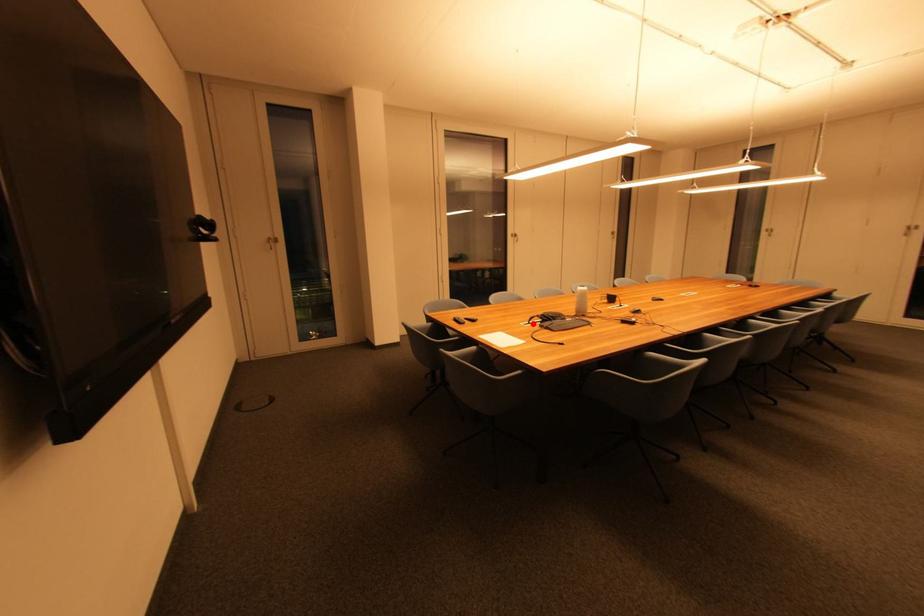
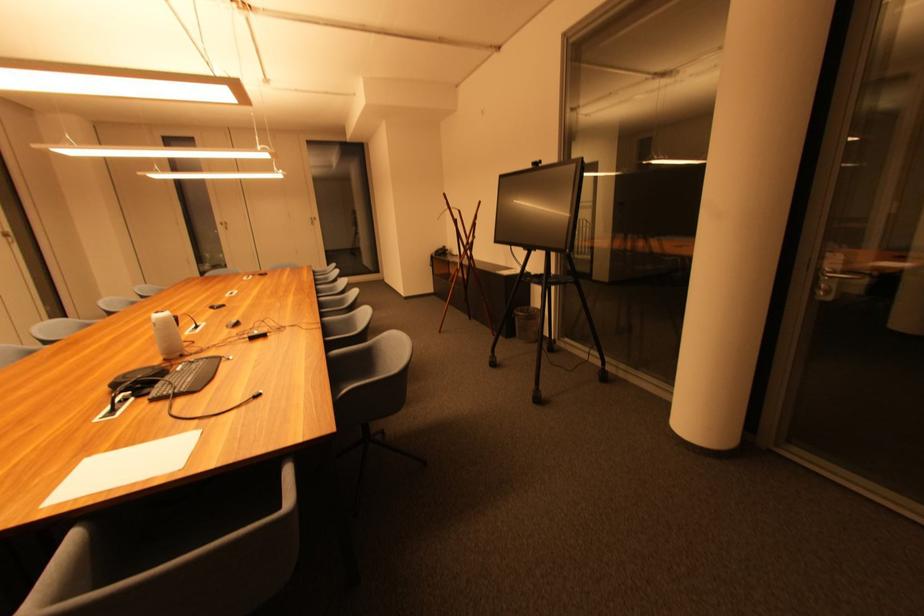
Find the pixel in the second image that matches the highlighted location in the first image.

(114, 411)